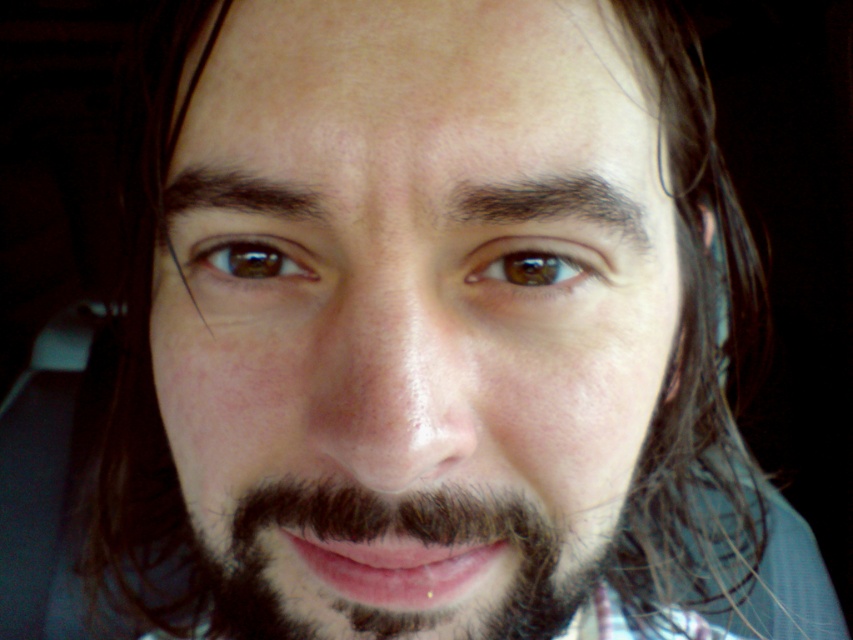
Question: Which object is closer to the camera taking this photo?

Choices:
 (A) brown matte eye at center
 (B) dark brown fuzzy beard at lower center
 (C) smooth skin face at center

Answer: (C)

Question: Does smooth skin face at center have a larger size compared to dark brown fuzzy beard at lower center?

Choices:
 (A) no
 (B) yes

Answer: (B)

Question: Which of the following is the closest to the observer?

Choices:
 (A) (511, 260)
 (B) (247, 237)
 (C) (396, 556)
 (D) (440, 568)

Answer: (A)

Question: Which of these objects is positioned farthest from the brown matte eye at upper center?

Choices:
 (A) brown matte eye at center
 (B) dark brown fuzzy beard at lower center

Answer: (B)

Question: Is smooth skin face at center wider than brown matte eye at center?

Choices:
 (A) yes
 (B) no

Answer: (A)

Question: Observing the image, what is the correct spatial positioning of dark brown fuzzy beard at lower center in reference to brown matte eye at center?

Choices:
 (A) left
 (B) right

Answer: (A)